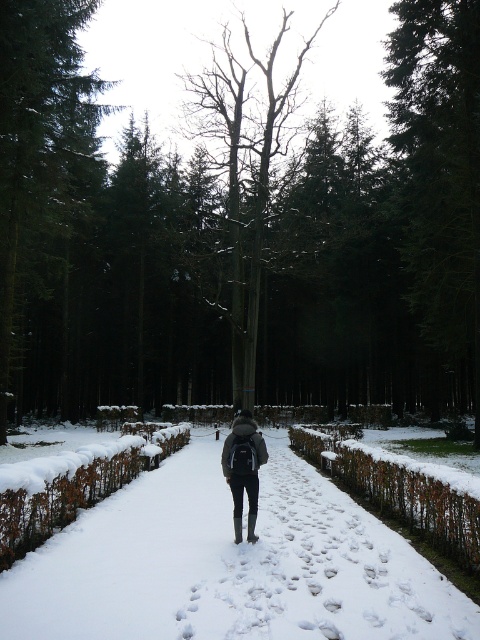
Question: Which of the following is the farthest from the observer?

Choices:
 (A) (330, 625)
 (B) (421, 204)

Answer: (B)

Question: Which point is farther to the camera?

Choices:
 (A) green textured tree at upper center
 (B) dark gray fabric backpack at center
 (C) green textured tree at upper right

Answer: (C)

Question: Where is bare wood tree at center located in relation to dark gray fabric backpack at center in the image?

Choices:
 (A) above
 (B) below

Answer: (A)

Question: Is white snow at center further to the viewer compared to green textured tree at upper center?

Choices:
 (A) yes
 (B) no

Answer: (B)

Question: Is white snow at center to the left of green textured tree at upper center from the viewer's perspective?

Choices:
 (A) no
 (B) yes

Answer: (A)

Question: Which of these objects is positioned closest to the dark gray fabric backpack at center?

Choices:
 (A) green textured tree at upper right
 (B) white snow at center
 (C) bare wood tree at center

Answer: (B)